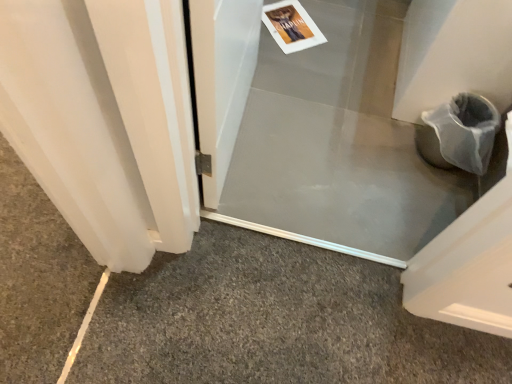
Question: Does clear plastic screen door at center, the second screen door positioned from the back, have a lesser height compared to gray carpet at lower left?

Choices:
 (A) yes
 (B) no

Answer: (B)

Question: Can you confirm if clear plastic screen door at center, marked as the 1th screen door in a front-to-back arrangement, is positioned to the right of gray carpet at lower left?

Choices:
 (A) yes
 (B) no

Answer: (B)

Question: From a real-world perspective, is clear plastic screen door at center, marked as the 1th screen door in a front-to-back arrangement, on gray carpet at lower left?

Choices:
 (A) no
 (B) yes

Answer: (B)

Question: Is clear plastic screen door at center, marked as the 1th screen door in a front-to-back arrangement, smaller than gray carpet at lower left?

Choices:
 (A) no
 (B) yes

Answer: (A)

Question: Does clear plastic screen door at center, marked as the 1th screen door in a front-to-back arrangement, have a greater width compared to gray carpet at lower left?

Choices:
 (A) no
 (B) yes

Answer: (A)

Question: Visually, is transparent plastic screen door at center, which is counted as the 1th screen door, starting from the back, positioned to the left or to the right of gray carpet at lower left?

Choices:
 (A) left
 (B) right

Answer: (B)

Question: Is transparent plastic screen door at center, which ranks as the 2th screen door in front-to-back order, bigger or smaller than gray carpet at lower left?

Choices:
 (A) big
 (B) small

Answer: (B)

Question: From a real-world perspective, is transparent plastic screen door at center, which ranks as the 2th screen door in front-to-back order, above or below gray carpet at lower left?

Choices:
 (A) below
 (B) above

Answer: (A)

Question: In terms of width, does transparent plastic screen door at center, which ranks as the 2th screen door in front-to-back order, look wider or thinner when compared to gray carpet at lower left?

Choices:
 (A) wide
 (B) thin

Answer: (A)

Question: Is clear plastic screen door at center, marked as the 1th screen door in a front-to-back arrangement, to the left or to the right of gray carpet at lower left in the image?

Choices:
 (A) left
 (B) right

Answer: (A)

Question: Is clear plastic screen door at center, marked as the 1th screen door in a front-to-back arrangement, situated inside gray carpet at lower left or outside?

Choices:
 (A) outside
 (B) inside

Answer: (A)

Question: From a real-world perspective, is clear plastic screen door at center, the second screen door positioned from the back, above or below gray carpet at lower left?

Choices:
 (A) below
 (B) above

Answer: (B)

Question: Does point (201, 4) appear closer or farther from the camera than point (154, 329)?

Choices:
 (A) closer
 (B) farther

Answer: (A)

Question: Choose the correct answer: Is clear plastic screen door at center, marked as the 1th screen door in a front-to-back arrangement, inside transparent plastic screen door at center, which is counted as the 1th screen door, starting from the back, or outside it?

Choices:
 (A) outside
 (B) inside

Answer: (A)

Question: In the image, is clear plastic screen door at center, marked as the 1th screen door in a front-to-back arrangement, positioned in front of or behind transparent plastic screen door at center, which ranks as the 2th screen door in front-to-back order?

Choices:
 (A) front
 (B) behind

Answer: (A)